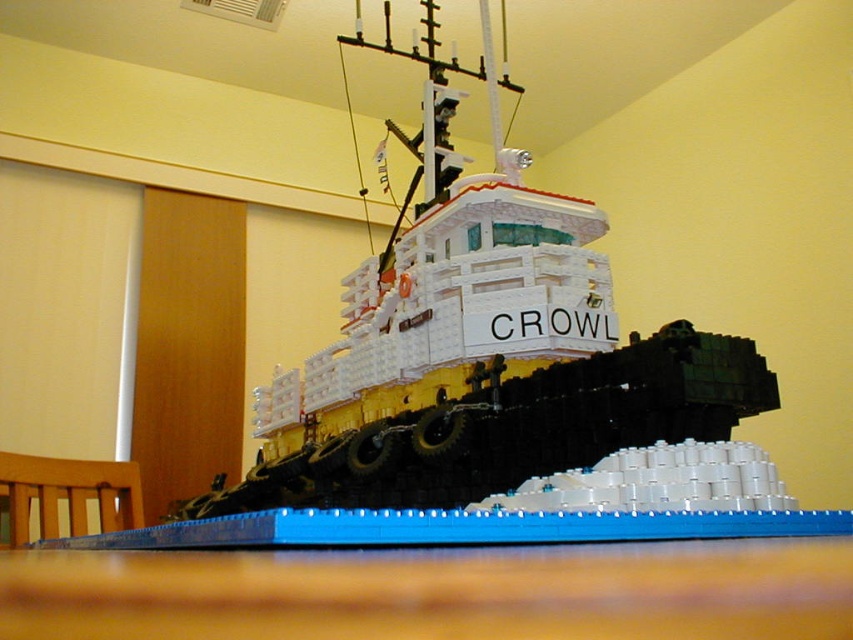
Question: Which point is farther to the camera?

Choices:
 (A) white plastic boat at center
 (B) blue plastic table at lower center

Answer: (A)

Question: Does white plastic boat at center appear over blue plastic table at lower center?

Choices:
 (A) no
 (B) yes

Answer: (B)

Question: Considering the relative positions of white plastic boat at center and blue plastic table at lower center in the image provided, where is white plastic boat at center located with respect to blue plastic table at lower center?

Choices:
 (A) below
 (B) above

Answer: (B)

Question: Does white plastic boat at center have a larger size compared to blue plastic table at lower center?

Choices:
 (A) yes
 (B) no

Answer: (A)

Question: Which point appears closest to the camera in this image?

Choices:
 (A) [840, 540]
 (B) [281, 394]

Answer: (A)

Question: Which point is closer to the camera?

Choices:
 (A) blue plastic table at lower center
 (B) white plastic boat at center

Answer: (A)